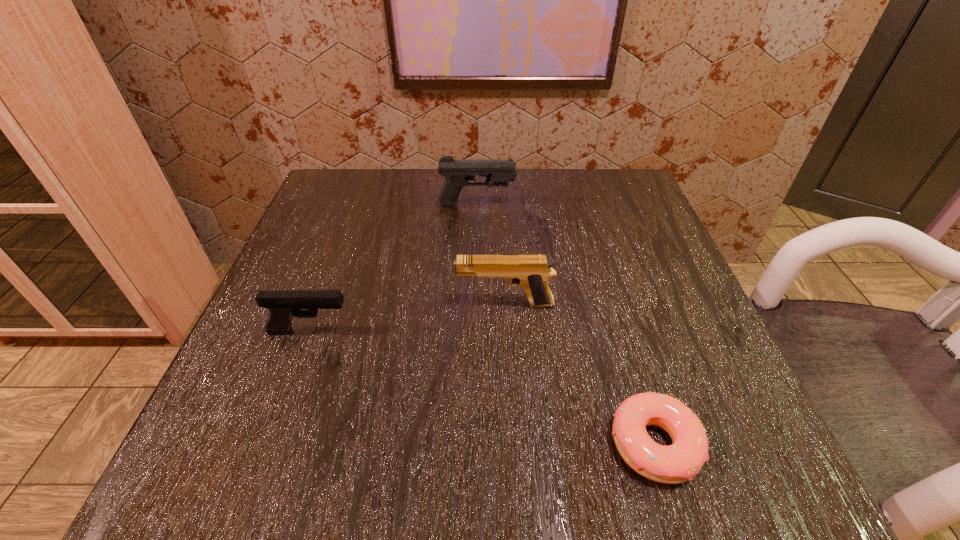
At what (x,y) coordinates should I click in order to perform the action: click on free point at the right edge. Please return your answer as a coordinate pair (x, y). Image resolution: width=960 pixels, height=540 pixels. Looking at the image, I should click on (635, 248).

Where is `free space at the far left corner of the desktop`? free space at the far left corner of the desktop is located at coordinates (388, 197).

Where is `free space at the far right corner of the desktop`? free space at the far right corner of the desktop is located at coordinates (599, 211).

The width and height of the screenshot is (960, 540). Identify the location of vacant space at the near right corner of the desktop. (668, 438).

You are a GUI agent. You are given a task and a screenshot of the screen. Output one action in this format:
    pyautogui.click(x=<x>, y=<y>)
    Task: Click on the unoccupied area between the nearest object and the shortest pistol
    The height and width of the screenshot is (540, 960).
    Given the screenshot: What is the action you would take?
    pyautogui.click(x=482, y=388)

Identify the location of vacant region between the doughnut and the third nearest object. (580, 374).

Locate an element on the screen. This screenshot has height=540, width=960. free space between the nearest object and the farthest object is located at coordinates [565, 325].

Find the location of a particular element. vacant space that's between the second shortest object and the doughnut is located at coordinates (482, 388).

Identify the location of vacant area that lies between the nearest object and the farthest pistol. The image size is (960, 540). (565, 325).

In order to click on free spot between the second nearest pistol and the farthest object in this screenshot , I will do `click(491, 255)`.